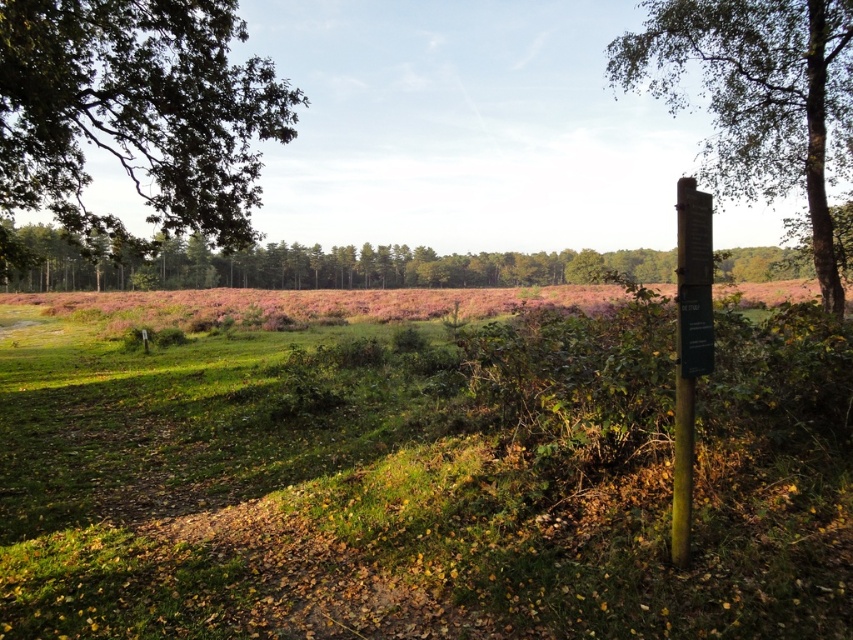
Is point (715, 435) behind point (799, 164)?

That is False.

Can you confirm if green grass at center is positioned below green leafy tree at right?

Indeed, green grass at center is positioned under green leafy tree at right.

Between point (577, 490) and point (662, 93), which one is positioned in front?

Point (577, 490) is in front.

What are the coordinates of `green grass at center` in the screenshot? It's located at (424, 481).

Who is positioned more to the right, green grass at center or wooden signpost at right?

Positioned to the right is wooden signpost at right.

Is point (642, 563) farther from camera compared to point (688, 212)?

Yes, point (642, 563) is behind point (688, 212).

Where is `green grass at center`? green grass at center is located at coordinates (424, 481).

Can you confirm if green grass at center is positioned to the right of green leafy tree at upper left?

Indeed, green grass at center is positioned on the right side of green leafy tree at upper left.

The image size is (853, 640). I want to click on green grass at center, so click(x=424, y=481).